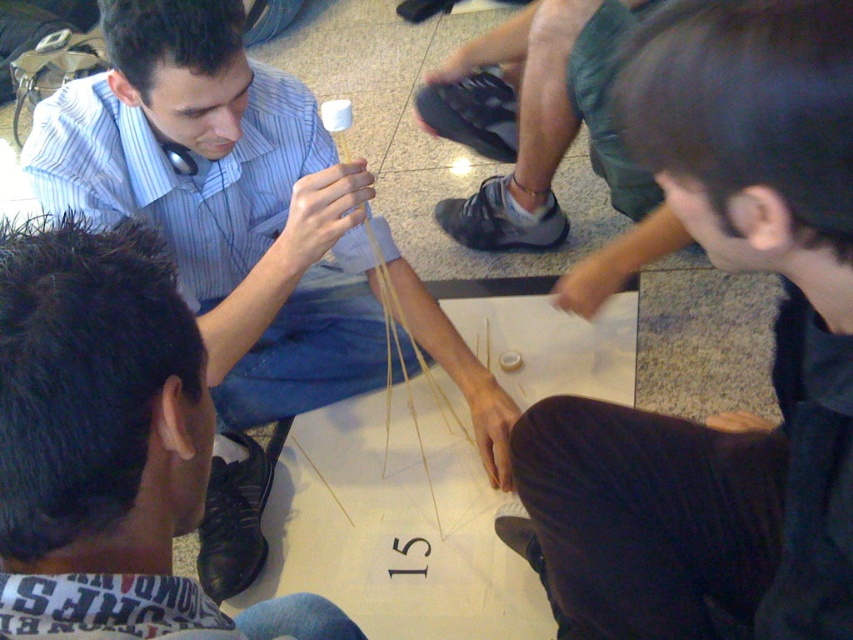
Does dark brown leather jacket at lower right have a lesser height compared to dark blue jeans at lower left?

No, dark brown leather jacket at lower right is not shorter than dark blue jeans at lower left.

Does dark brown leather jacket at lower right have a greater width compared to dark blue jeans at lower left?

Yes, dark brown leather jacket at lower right is wider than dark blue jeans at lower left.

The width and height of the screenshot is (853, 640). Describe the element at coordinates (775, 360) in the screenshot. I see `dark brown leather jacket at lower right` at that location.

This screenshot has height=640, width=853. Find the location of `dark brown leather jacket at lower right`. dark brown leather jacket at lower right is located at coordinates (775, 360).

Does dark brown leather jacket at lower right have a greater width compared to matte blue shirt at center?

Incorrect, dark brown leather jacket at lower right's width does not surpass matte blue shirt at center's.

Which of these two, dark brown leather jacket at lower right or matte blue shirt at center, stands taller?

matte blue shirt at center is taller.

What do you see at coordinates (775, 360) in the screenshot? The width and height of the screenshot is (853, 640). I see `dark brown leather jacket at lower right` at bounding box center [775, 360].

Find the location of a particular element. dark brown leather jacket at lower right is located at coordinates (775, 360).

Consider the image. Does matte blue shirt at center appear on the left side of dark blue jeans at lower left?

Correct, you'll find matte blue shirt at center to the left of dark blue jeans at lower left.

Measure the distance between matte blue shirt at center and camera.

matte blue shirt at center is 3.29 feet away from camera.

The height and width of the screenshot is (640, 853). I want to click on matte blue shirt at center, so click(223, 200).